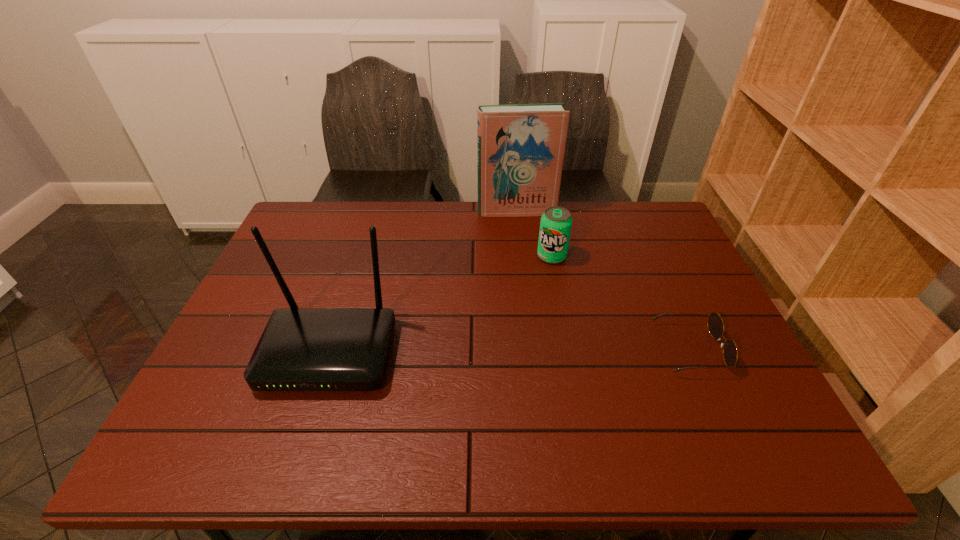
Where is `the second tallest object`? The image size is (960, 540). the second tallest object is located at coordinates (301, 349).

Where is `router`? router is located at coordinates (301, 349).

Where is `the rightmost object`? the rightmost object is located at coordinates coord(715,324).

Identify the location of sunglasses. (715, 324).

The height and width of the screenshot is (540, 960). I want to click on the farthest object, so click(x=520, y=147).

Find the location of a particular element. the tallest object is located at coordinates (520, 147).

You are a GUI agent. You are given a task and a screenshot of the screen. Output one action in this format:
    pyautogui.click(x=<x>, y=<y>)
    Task: Click on the pop soda
    The height and width of the screenshot is (540, 960).
    Given the screenshot: What is the action you would take?
    pyautogui.click(x=555, y=227)

Find the location of `the second shortest object`. the second shortest object is located at coordinates (555, 227).

At what (x,y) coordinates should I click in order to perform the action: click on vacant space situated 0.120m on the cover of the farthest object. Please return your answer as a coordinate pair (x, y). The image size is (960, 540). Looking at the image, I should click on pos(523,239).

Identify the location of vacant space located on the cover of the farthest object. (523, 239).